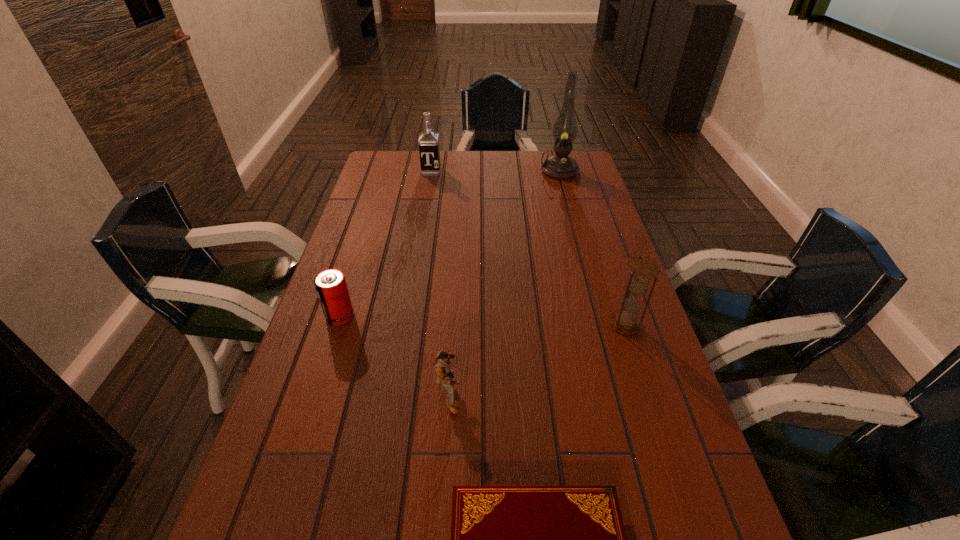
Find the location of a particular element. Image resolution: width=960 pixels, height=540 pixels. vacant space at the far right corner is located at coordinates (572, 154).

Identify the location of vacant point located between the vodka and the puncher. Image resolution: width=960 pixels, height=540 pixels. (440, 282).

The width and height of the screenshot is (960, 540). I want to click on free space between the hourglass and the fifth farthest object, so click(538, 359).

Where is `vacant area that lies between the fifth farthest object and the oil lamp`? vacant area that lies between the fifth farthest object and the oil lamp is located at coordinates (504, 282).

This screenshot has width=960, height=540. I want to click on blank region between the leftmost object and the puncher, so click(395, 355).

The height and width of the screenshot is (540, 960). Identify the location of free spot between the leftmost object and the third tallest object. (483, 320).

At what (x,y) coordinates should I click in order to perform the action: click on vacant area that lies between the tallest object and the fifth object from right to left. Please return your answer as a coordinate pair (x, y). Looking at the image, I should click on (495, 171).

Where is `unoccupied position between the tallest object and the fourth shortest object`? This screenshot has height=540, width=960. unoccupied position between the tallest object and the fourth shortest object is located at coordinates (592, 247).

The width and height of the screenshot is (960, 540). I want to click on empty location between the leftmost object and the fifth farthest object, so click(x=395, y=355).

Locate an element on the screen. vacant region between the tallest object and the hourglass is located at coordinates (592, 247).